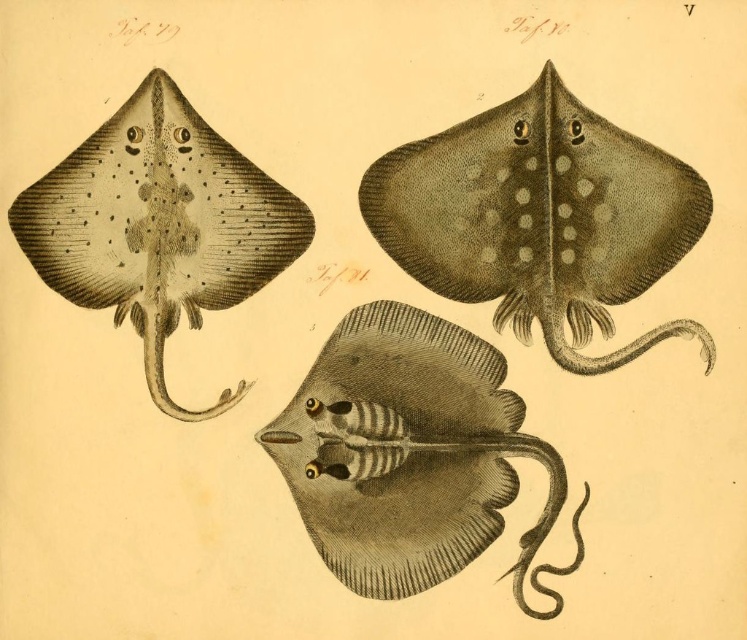
Does point (639, 230) come closer to viewer compared to point (385, 360)?

Yes.

Locate an element on the screen. The height and width of the screenshot is (640, 747). brown dotted stingray at upper right is located at coordinates (539, 218).

How distant is black textured stingray at upper left from gray striped stingray at center?

black textured stingray at upper left and gray striped stingray at center are 21.90 centimeters apart from each other.

Does point (276, 244) lie in front of point (415, 560)?

No, it is not.

Is point (117, 202) positioned behind point (456, 364)?

No.

Image resolution: width=747 pixels, height=640 pixels. I want to click on black textured stingray at upper left, so click(x=158, y=225).

Is brown dotted stingray at upper right wider than black textured stingray at upper left?

Correct, the width of brown dotted stingray at upper right exceeds that of black textured stingray at upper left.

Does point (452, 182) come behind point (190, 116)?

That is True.

Where is `brown dotted stingray at upper right`? brown dotted stingray at upper right is located at coordinates (539, 218).